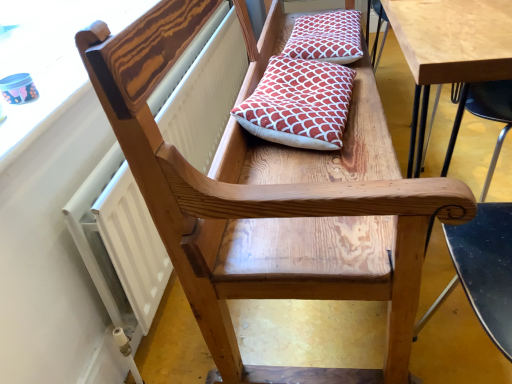
You are a GUI agent. You are given a task and a screenshot of the screen. Output one action in this format:
    pyautogui.click(x=<x>, y=<y>)
    Task: Click on the wooden chair arm at upper left
    
    Given the screenshot: What is the action you would take?
    pyautogui.click(x=49, y=59)

Describe the element at coordinates (49, 59) in the screenshot. I see `wooden chair arm at upper left` at that location.

Locate an element on the screen. This screenshot has width=512, height=384. red patterned cushion at upper center, the second pillow in the bottom-to-top sequence is located at coordinates (326, 37).

Find the location of `red patterned cushion at center, acting as the second pillow starting from the back`. red patterned cushion at center, acting as the second pillow starting from the back is located at coordinates (298, 104).

Find the location of `wooden chair arm at upper left`. wooden chair arm at upper left is located at coordinates (49, 59).

Is white textured radiator at upper left outside of red patterned cushion at center, the first pillow positioned from the bottom?

That's correct, white textured radiator at upper left is outside of red patterned cushion at center, the first pillow positioned from the bottom.

Considering the relative positions of white textured radiator at upper left and red patterned cushion at center, the second pillow from the top, in the image provided, is white textured radiator at upper left to the left of red patterned cushion at center, the second pillow from the top, from the viewer's perspective?

Correct, you'll find white textured radiator at upper left to the left of red patterned cushion at center, the second pillow from the top.

From a real-world perspective, is white textured radiator at upper left over red patterned cushion at center, the second pillow from the top?

No, from a real-world perspective, white textured radiator at upper left is not on top of red patterned cushion at center, the second pillow from the top.

From the image's perspective, which object appears higher, white textured radiator at upper left or red patterned cushion at center, the second pillow from the top?

red patterned cushion at center, the second pillow from the top.

Which object is positioned more to the left, wooden chair arm at upper left or white textured radiator at upper left?

From the viewer's perspective, wooden chair arm at upper left appears more on the left side.

Looking at this image, is wooden chair arm at upper left completely or partially outside of white textured radiator at upper left?

Absolutely, wooden chair arm at upper left is external to white textured radiator at upper left.

In the scene shown: Is wooden chair arm at upper left far from white textured radiator at upper left?

No, wooden chair arm at upper left is not far away from white textured radiator at upper left.

Is the depth of red patterned cushion at center, arranged as the 1th pillow when viewed from the front, less than that of white textured radiator at upper left?

No, red patterned cushion at center, arranged as the 1th pillow when viewed from the front, is behind white textured radiator at upper left.

From a real-world perspective, is red patterned cushion at center, the second pillow from the top, positioned over white textured radiator at upper left based on gravity?

Yes, from a real-world perspective, red patterned cushion at center, the second pillow from the top, is over white textured radiator at upper left

Can you tell me how much red patterned cushion at center, the first pillow positioned from the bottom, and white textured radiator at upper left differ in facing direction?

4.19 degrees separate the facing orientations of red patterned cushion at center, the first pillow positioned from the bottom, and white textured radiator at upper left.

Between red patterned cushion at center, acting as the second pillow starting from the back, and white textured radiator at upper left, which one has more height?

Standing taller between the two is white textured radiator at upper left.

Between red patterned cushion at upper center, the second pillow viewed from the front, and wooden chair arm at upper left, which one has larger width?

red patterned cushion at upper center, the second pillow viewed from the front, is wider.

Would you consider red patterned cushion at upper center, the second pillow in the bottom-to-top sequence, to be distant from wooden chair arm at upper left?

No, red patterned cushion at upper center, the second pillow in the bottom-to-top sequence, is not far away from wooden chair arm at upper left.

How many degrees apart are the facing directions of red patterned cushion at upper center, positioned as the 1th pillow in top-to-bottom order, and wooden chair arm at upper left?

The facing directions of red patterned cushion at upper center, positioned as the 1th pillow in top-to-bottom order, and wooden chair arm at upper left are 3.6 degrees apart.

Does red patterned cushion at upper center, the second pillow in the bottom-to-top sequence, turn towards wooden chair arm at upper left?

No.

From the image's perspective, which is below, red patterned cushion at upper center, positioned as the 1th pillow in top-to-bottom order, or red patterned cushion at center, acting as the second pillow starting from the back?

red patterned cushion at center, acting as the second pillow starting from the back.

Considering the relative sizes of red patterned cushion at upper center, the second pillow viewed from the front, and red patterned cushion at center, the second pillow from the top, in the image provided, is red patterned cushion at upper center, the second pillow viewed from the front, smaller than red patterned cushion at center, the second pillow from the top,?

Indeed, red patterned cushion at upper center, the second pillow viewed from the front, has a smaller size compared to red patterned cushion at center, the second pillow from the top.

Between red patterned cushion at upper center, positioned as the 1th pillow in top-to-bottom order, and red patterned cushion at center, acting as the second pillow starting from the back, which one has more height?

Standing taller between the two is red patterned cushion at center, acting as the second pillow starting from the back.

Consider the image. Which is more to the right, red patterned cushion at upper center, positioned as the 1th pillow in top-to-bottom order, or red patterned cushion at center, the second pillow from the top?

red patterned cushion at upper center, positioned as the 1th pillow in top-to-bottom order, is more to the right.

Considering the positions of objects red patterned cushion at center, the first pillow positioned from the bottom, and red patterned cushion at upper center, the second pillow viewed from the front, in the image provided, who is more to the left, red patterned cushion at center, the first pillow positioned from the bottom, or red patterned cushion at upper center, the second pillow viewed from the front,?

red patterned cushion at center, the first pillow positioned from the bottom, is more to the left.

Is point (296, 88) positioned before point (357, 15)?

Yes, point (296, 88) is in front of point (357, 15).

Looking at the image, does red patterned cushion at center, acting as the second pillow starting from the back, seem bigger or smaller compared to red patterned cushion at upper center, the second pillow in the bottom-to-top sequence?

Clearly, red patterned cushion at center, acting as the second pillow starting from the back, is larger in size than red patterned cushion at upper center, the second pillow in the bottom-to-top sequence.

In the scene shown: Is red patterned cushion at center, the second pillow from the top, aimed at red patterned cushion at upper center, the second pillow in the bottom-to-top sequence?

No, red patterned cushion at center, the second pillow from the top, is not turned towards red patterned cushion at upper center, the second pillow in the bottom-to-top sequence.

Does point (147, 298) lie behind point (310, 48)?

No.

From a real-world perspective, is white textured radiator at upper left physically below red patterned cushion at upper center, positioned as the 1th pillow in top-to-bottom order?

Yes.

Could you tell me if white textured radiator at upper left is facing red patterned cushion at upper center, the second pillow viewed from the front?

Yes, white textured radiator at upper left is aimed at red patterned cushion at upper center, the second pillow viewed from the front.

Identify the location of the 1st pillow behind the white textured radiator at upper left. The height and width of the screenshot is (384, 512). (298, 104).

You are a GUI agent. You are given a task and a screenshot of the screen. Output one action in this format:
    pyautogui.click(x=<x>, y=<y>)
    Task: Click on the radiator on the right of the wooden chair arm at upper left
    The width and height of the screenshot is (512, 384).
    Given the screenshot: What is the action you would take?
    pyautogui.click(x=119, y=244)

Estimate the real-world distances between objects in this image. Which object is closer to wooden chair arm at upper left, white textured radiator at upper left or red patterned cushion at center, arranged as the 1th pillow when viewed from the front?

white textured radiator at upper left lies closer to wooden chair arm at upper left than the other object.

Estimate the real-world distances between objects in this image. Which object is closer to red patterned cushion at upper center, the second pillow in the bottom-to-top sequence, white textured radiator at upper left or wooden chair arm at upper left?

Based on the image, white textured radiator at upper left appears to be nearer to red patterned cushion at upper center, the second pillow in the bottom-to-top sequence.

Estimate the real-world distances between objects in this image. Which object is further from white textured radiator at upper left, wooden chair arm at upper left or red patterned cushion at upper center, the 1th pillow when ordered from back to front?

red patterned cushion at upper center, the 1th pillow when ordered from back to front, is further to white textured radiator at upper left.

Which object lies further to the anchor point red patterned cushion at upper center, positioned as the 1th pillow in top-to-bottom order, red patterned cushion at center, the second pillow from the top, or white textured radiator at upper left?

white textured radiator at upper left is further to red patterned cushion at upper center, positioned as the 1th pillow in top-to-bottom order.

Which object lies further to the anchor point red patterned cushion at center, the second pillow from the top, red patterned cushion at upper center, positioned as the 1th pillow in top-to-bottom order, or wooden chair arm at upper left?

Among the two, wooden chair arm at upper left is located further to red patterned cushion at center, the second pillow from the top.

Estimate the real-world distances between objects in this image. Which object is further from red patterned cushion at upper center, positioned as the 1th pillow in top-to-bottom order, red patterned cushion at center, the second pillow from the top, or wooden chair arm at upper left?

wooden chair arm at upper left is further to red patterned cushion at upper center, positioned as the 1th pillow in top-to-bottom order.

Based on their spatial positions, is red patterned cushion at center, the first pillow positioned from the bottom, or red patterned cushion at upper center, the second pillow viewed from the front, further from wooden chair arm at upper left?

red patterned cushion at upper center, the second pillow viewed from the front, is further to wooden chair arm at upper left.

Estimate the real-world distances between objects in this image. Which object is closer to wooden chair arm at upper left, red patterned cushion at upper center, the second pillow in the bottom-to-top sequence, or red patterned cushion at center, the first pillow positioned from the bottom?

red patterned cushion at center, the first pillow positioned from the bottom.

Where is `pillow located between white textured radiator at upper left and red patterned cushion at upper center, the second pillow in the bottom-to-top sequence, in the depth direction`? This screenshot has height=384, width=512. pillow located between white textured radiator at upper left and red patterned cushion at upper center, the second pillow in the bottom-to-top sequence, in the depth direction is located at coordinates (298, 104).

Image resolution: width=512 pixels, height=384 pixels. I want to click on radiator between wooden chair arm at upper left and red patterned cushion at center, the first pillow positioned from the bottom, from left to right, so click(x=119, y=244).

Find the location of a particular element. This screenshot has width=512, height=384. pillow positioned between wooden chair arm at upper left and red patterned cushion at upper center, the second pillow viewed from the front, from near to far is located at coordinates (298, 104).

Identify the location of radiator located between wooden chair arm at upper left and red patterned cushion at upper center, the 1th pillow when ordered from back to front, in the depth direction. The width and height of the screenshot is (512, 384). (119, 244).